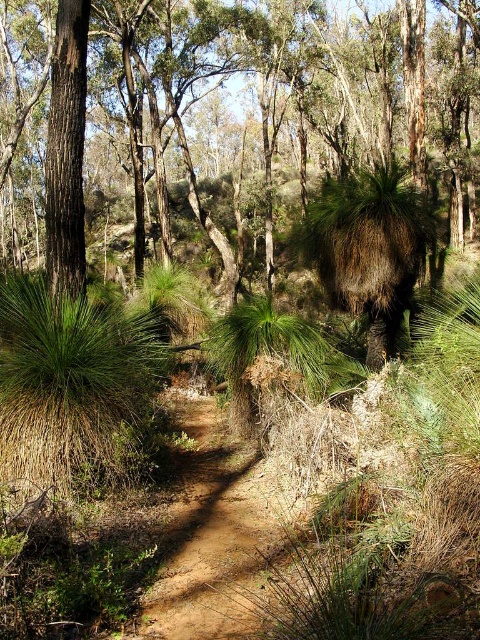
Looking at this image, you are a hiker trying to navigate through the forest. You see the brown rough tree at center ahead of you. If you walk straight ahead, will you encounter the tree before reaching the end of the visible path?

The brown rough tree at center is located at point (x=324, y=77), which is closer to your current position than the end of the visible path. Therefore, you will encounter the tree before reaching the end of the visible path.

Based on the photo, you are a hiker who wants to walk from the brown rough tree at center to the smooth brown tree trunk at upper left. The path between them is 67.97 feet long. If your average walking speed is 3 miles per hour, how many minutes will it take you to walk between them?

The distance between the brown rough tree at center and the smooth brown tree trunk at upper left is 67.97 feet. Converting this to miles, 67.97 feet is approximately 0.0129 miles. At a walking speed of 3 mph, the time taken would be distance divided by speed, so 0.0129 miles divided by 3 mph equals approximately 0.0043 hours. Converting hours to minutes by multiplying by 60 gives roughly 0.26 minutes, which is about 16 seconds. Therefore, it would take roughly 16 seconds to walk between them.

You are a hiker who wants to take a photo of the smooth brown tree trunk at upper left without the brown rough tree at center blocking the view. Which direction should you move to get a clear shot?

You should move to the right of the path so that the brown rough tree at center is no longer blocking the view of the smooth brown tree trunk at upper left.